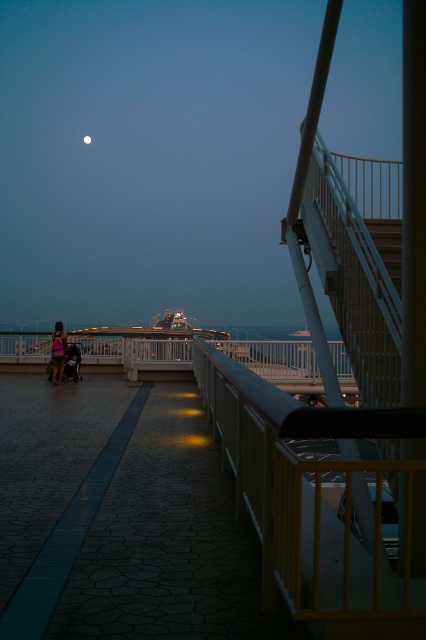
Based on the photo, can you confirm if yellow matte balustrade at center is bigger than bright silver moon at upper center?

Indeed, yellow matte balustrade at center has a larger size compared to bright silver moon at upper center.

In the scene shown: Can you confirm if yellow matte balustrade at center is smaller than bright silver moon at upper center?

No, yellow matte balustrade at center is not smaller than bright silver moon at upper center.

Where is `yellow matte balustrade at center`? This screenshot has height=640, width=426. yellow matte balustrade at center is located at coordinates (317, 502).

Is point (60, 380) positioned after point (88, 138)?

No, it is in front of (88, 138).

Consider the image. Between matte black jacket at left and bright silver moon at upper center, which one has more height?

matte black jacket at left

The image size is (426, 640). In order to click on matte black jacket at left in this screenshot , I will do `click(57, 353)`.

Where is `matte black jacket at left`? This screenshot has width=426, height=640. matte black jacket at left is located at coordinates (57, 353).

Does yellow matte balustrade at center come behind matte black jacket at left?

No, it is not.

Where is `yellow matte balustrade at center`? yellow matte balustrade at center is located at coordinates (317, 502).

I want to click on yellow matte balustrade at center, so click(x=317, y=502).